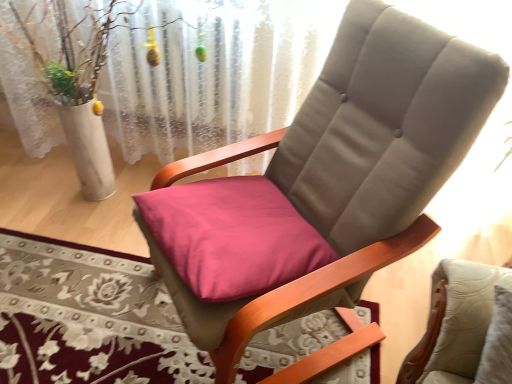
Question: From the image's perspective, is suede-like beige chair at center located above or below white lace curtain at upper center?

Choices:
 (A) below
 (B) above

Answer: (A)

Question: Considering the positions of point (238, 339) and point (102, 100), is point (238, 339) closer or farther from the camera than point (102, 100)?

Choices:
 (A) closer
 (B) farther

Answer: (A)

Question: Which of these objects is positioned closest to the suede-like beige chair at center?

Choices:
 (A) pink fabric cushion at center
 (B) white lace curtain at upper center

Answer: (A)

Question: Which object is positioned farthest from the pink fabric cushion at center?

Choices:
 (A) white lace curtain at upper center
 (B) suede-like beige chair at center

Answer: (A)